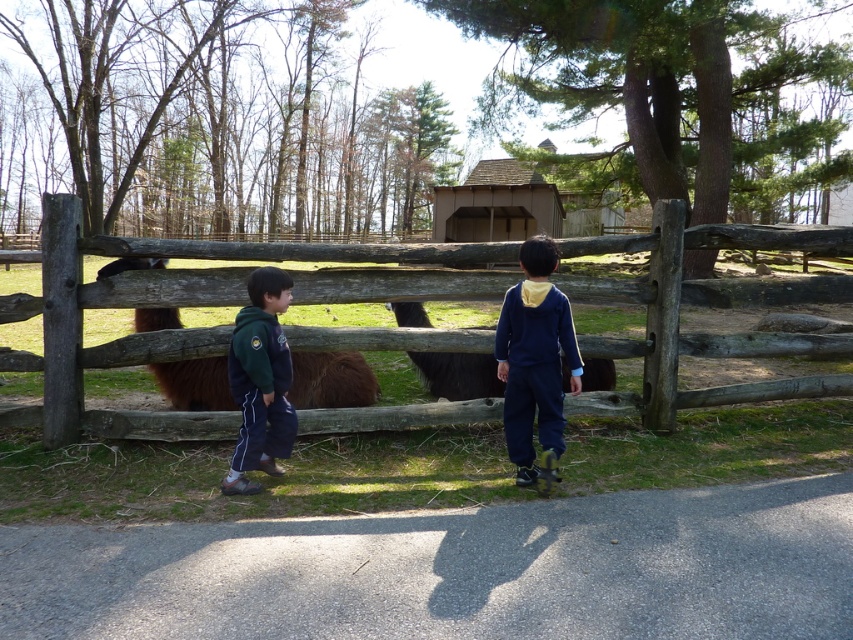
You are a photographer trying to capture a photo of the navy blue sweatshirt at center. Based on the coordinates provided in the scene description, where should you aim your camera to ensure the sweatshirt is centered in the frame?

The navy blue sweatshirt at center is located at point coordinates (535, 362), so you should aim your camera at those coordinates to center it in the frame.

You are a photographer trying to capture a photo of both the navy blue sweatshirt at center and the green fleece jacket at center. Which one should you focus on first if you want to include both in your frame without moving the camera?

You should focus on the green fleece jacket at center first because it is on the left side, so it will be closer to the edge of the frame if you center your shot on the navy blue sweatshirt at center.